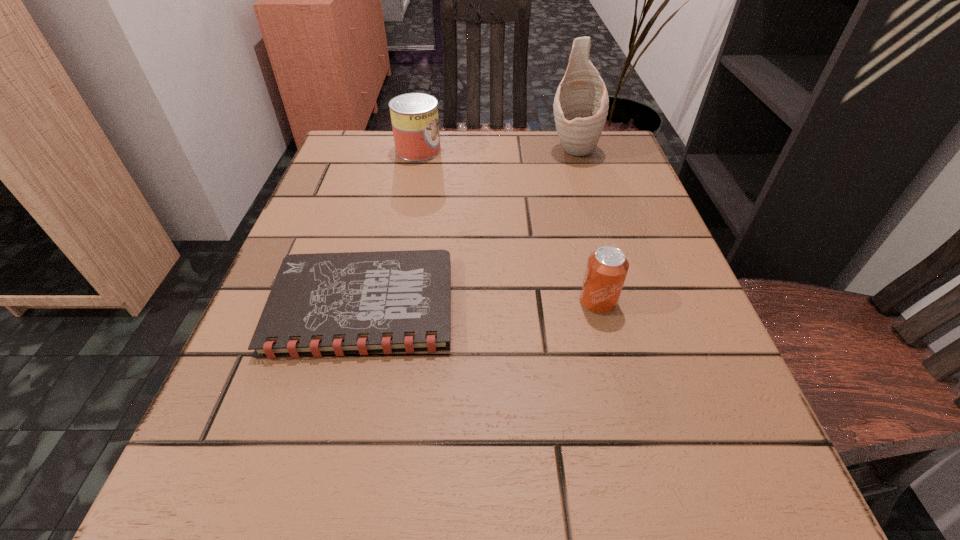
You are a GUI agent. You are given a task and a screenshot of the screen. Output one action in this format:
    pyautogui.click(x=<x>, y=<y>)
    Task: Click on the can situated at the far edge
    Image resolution: width=960 pixels, height=540 pixels.
    Given the screenshot: What is the action you would take?
    pyautogui.click(x=414, y=116)

The height and width of the screenshot is (540, 960). Find the location of `can present at the left edge`. can present at the left edge is located at coordinates (414, 116).

Find the location of a particular element. notebook present at the left edge is located at coordinates (320, 304).

This screenshot has width=960, height=540. Identify the location of pitcher at the right edge. (581, 103).

This screenshot has width=960, height=540. Find the location of `can positioned at the right edge`. can positioned at the right edge is located at coordinates (607, 267).

Where is `object present at the far left corner`? object present at the far left corner is located at coordinates [414, 116].

This screenshot has height=540, width=960. What are the coordinates of `object that is at the far right corner` in the screenshot? It's located at (581, 103).

Locate an element on the screen. This screenshot has width=960, height=540. vacant area at the far edge of the desktop is located at coordinates (x=488, y=181).

Find the location of a particular element. The height and width of the screenshot is (540, 960). vacant space at the near edge of the desktop is located at coordinates (531, 530).

In the image, there is a desktop. At what (x,y) coordinates should I click in order to perform the action: click on vacant space at the left edge. Please return your answer as a coordinate pair (x, y). Looking at the image, I should click on (381, 190).